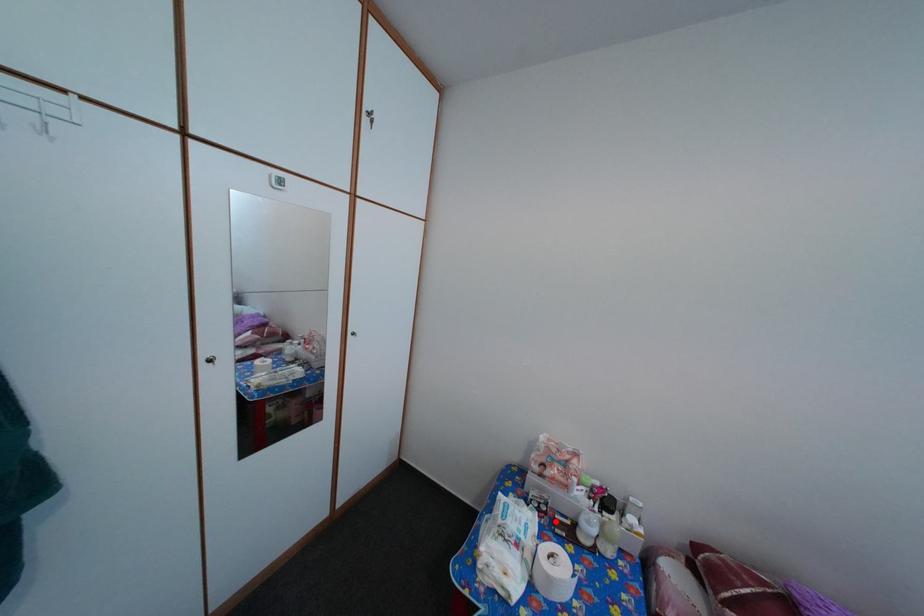
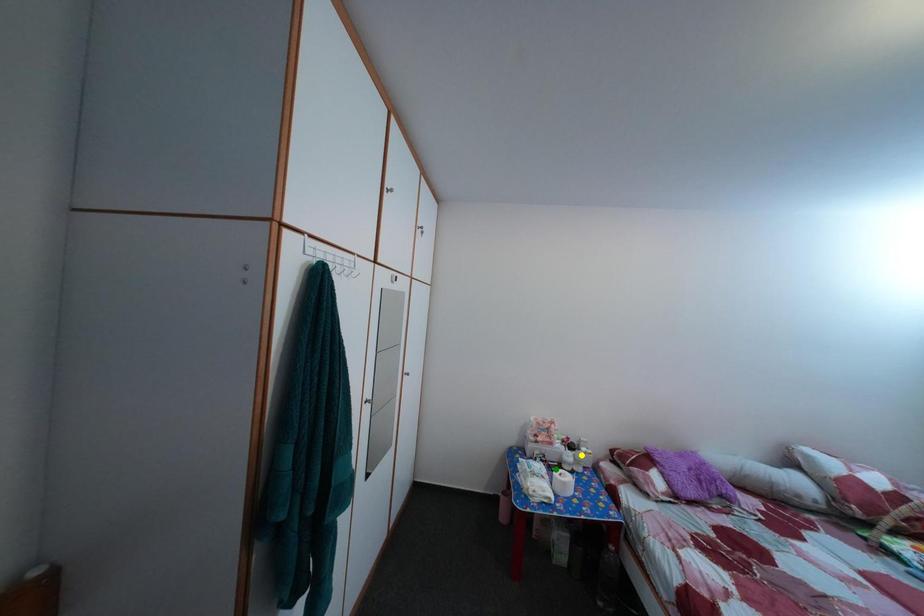
Question: I am providing you with two images of the same scene from different viewpoints. A red point is marked on the first image. You are given multiple points on the second image. Which spot in image 2 lines up with the point in image 1?

Choices:
 (A) blue point
 (B) yellow point
 (C) green point

Answer: (C)